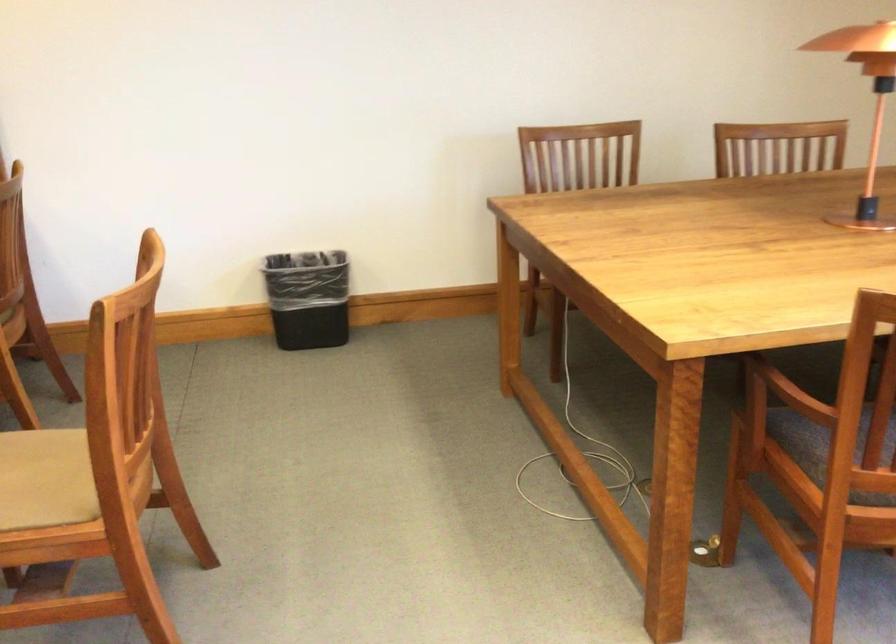
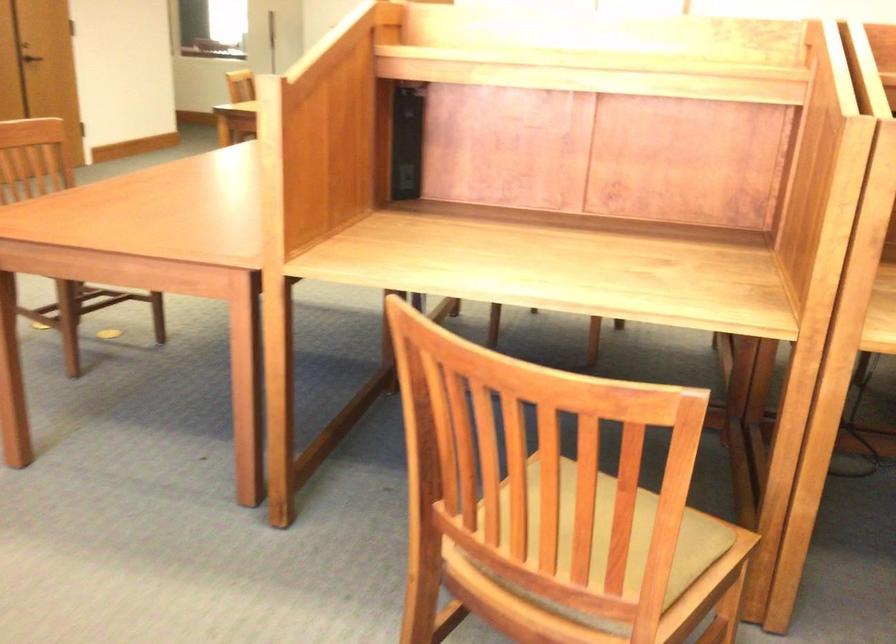
From the picture: The images are taken continuously from a first-person perspective. In which direction is your viewpoint rotating?

The camera rotated toward left-down.